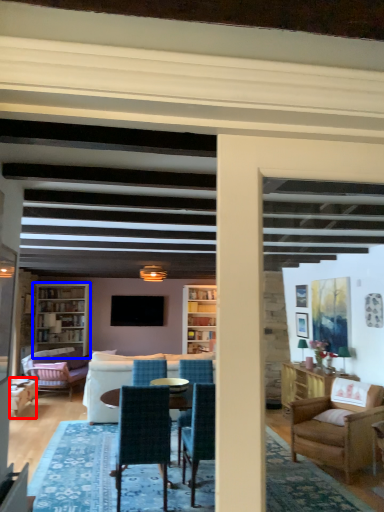
Question: Which of the following is the farthest to the observer, chair (highlighted by a red box) or bookcase (highlighted by a blue box)?

Choices:
 (A) chair
 (B) bookcase

Answer: (B)